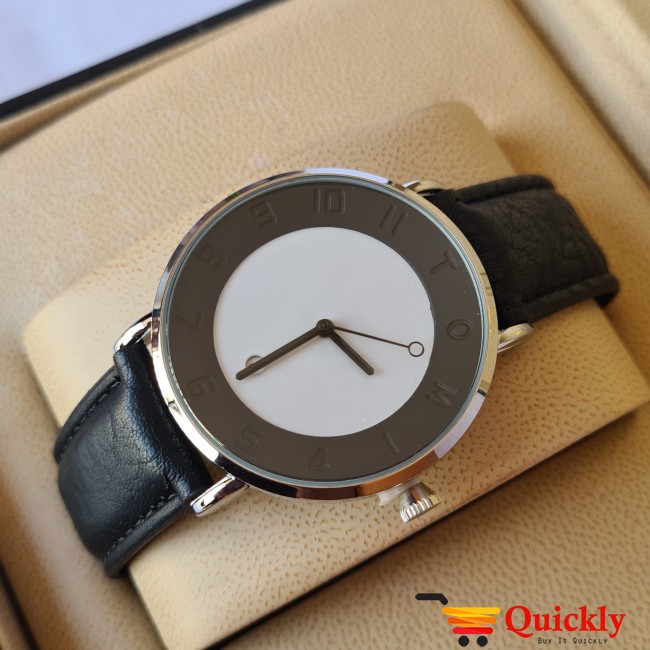
Identify the location of black handle. Image resolution: width=650 pixels, height=650 pixels. (431, 593).